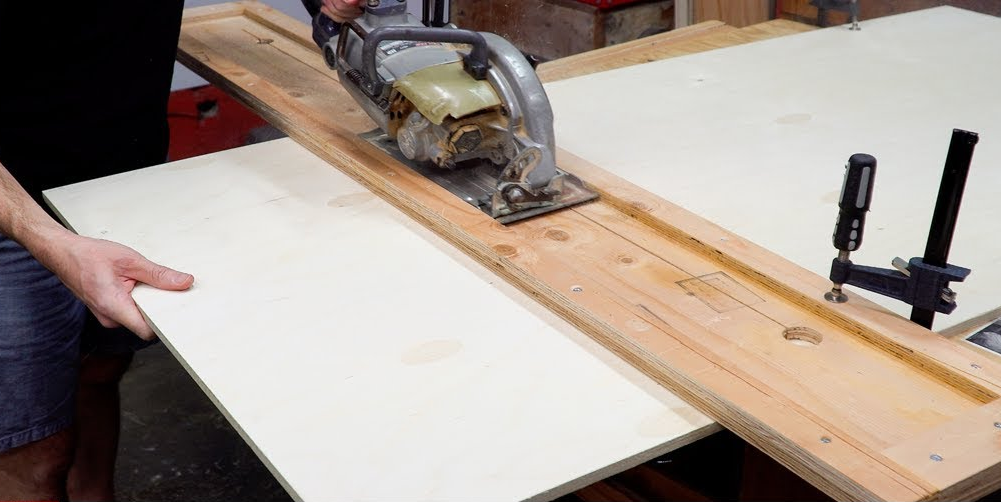
This screenshot has width=1001, height=502. In order to click on carpeting in this screenshot , I will do 193,136.